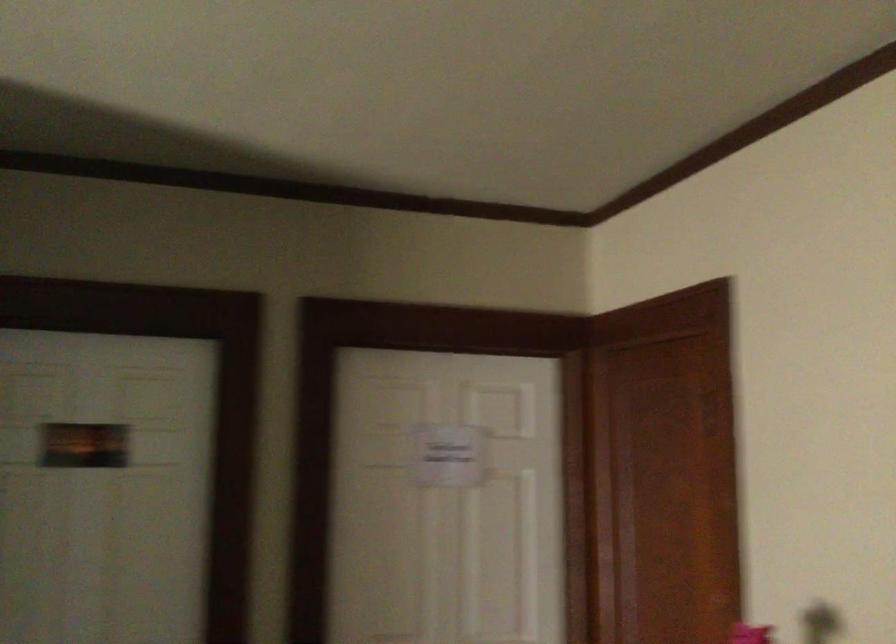
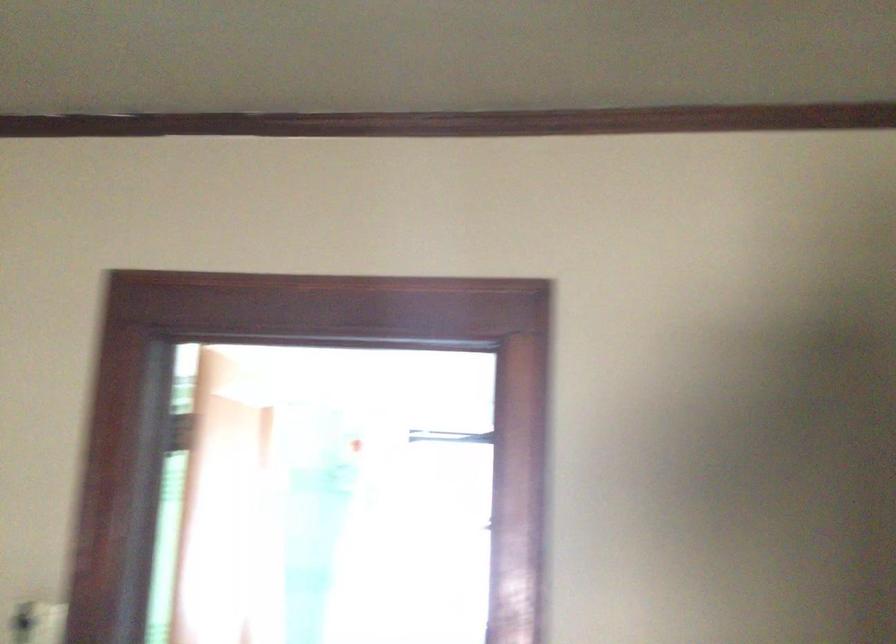
Question: The images are taken continuously from a first-person perspective. In which direction is your viewpoint rotating?

Choices:
 (A) Left
 (B) Right
 (C) Up
 (D) Down

Answer: (B)